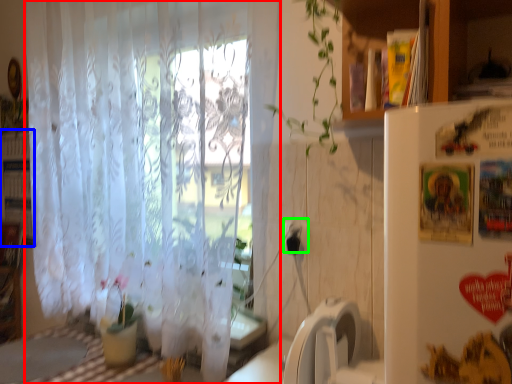
Question: Which object is the farthest from curtain (highlighted by a red box)? Choose among these: bookshelf (highlighted by a blue box) or electric outlet (highlighted by a green box).

Choices:
 (A) bookshelf
 (B) electric outlet

Answer: (A)